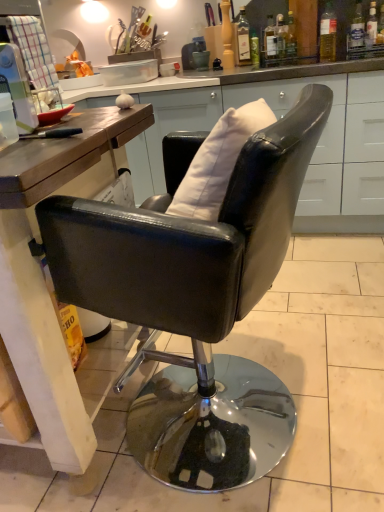
You are a GUI agent. You are given a task and a screenshot of the screen. Output one action in this format:
    pyautogui.click(x=<x>, y=<y>)
    Task: Click on the free space to the right of black leather chair at center
    Image resolution: width=384 pixels, height=512 pixels.
    Given the screenshot: What is the action you would take?
    pyautogui.click(x=345, y=378)